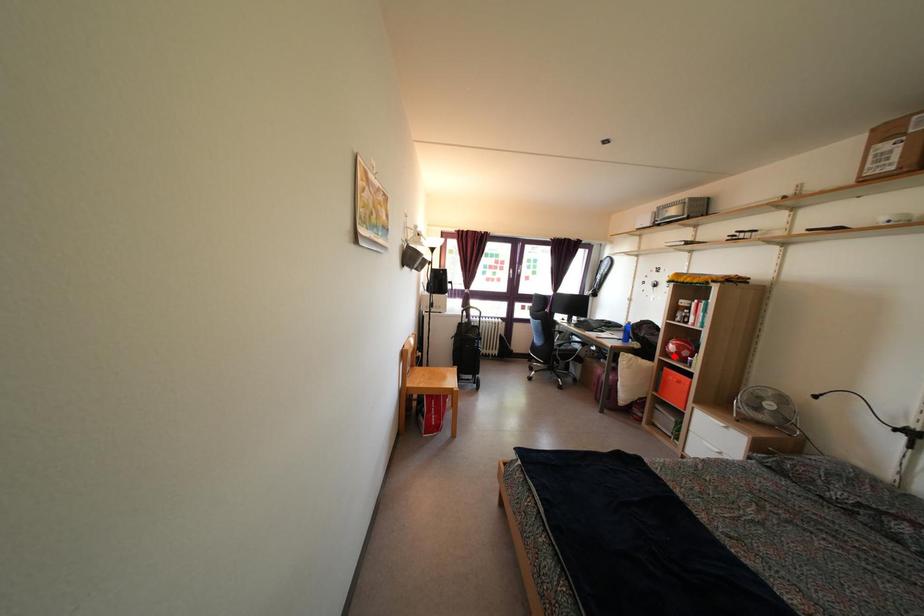
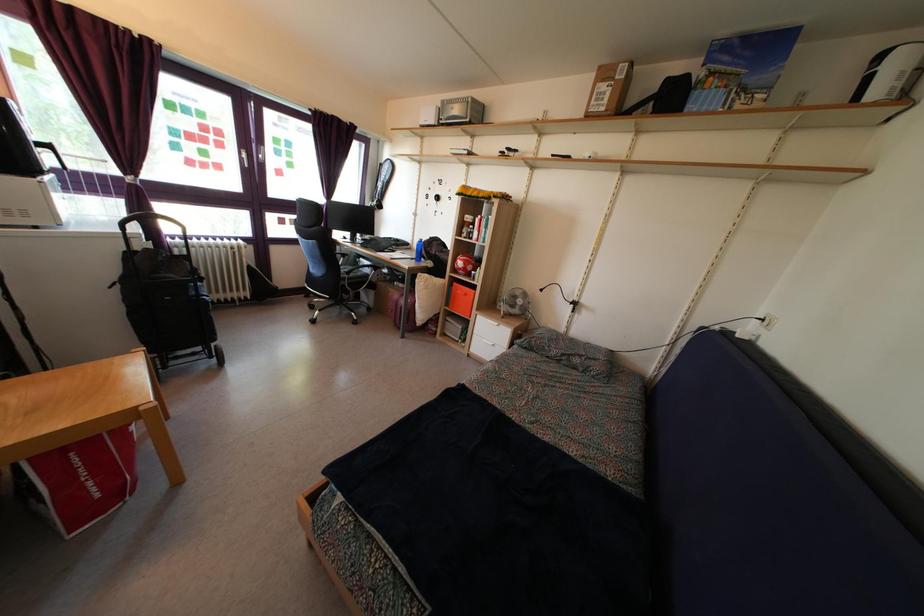
Locate, in the second image, the point that corresponds to the highlighted location in the first image.

(463, 272)